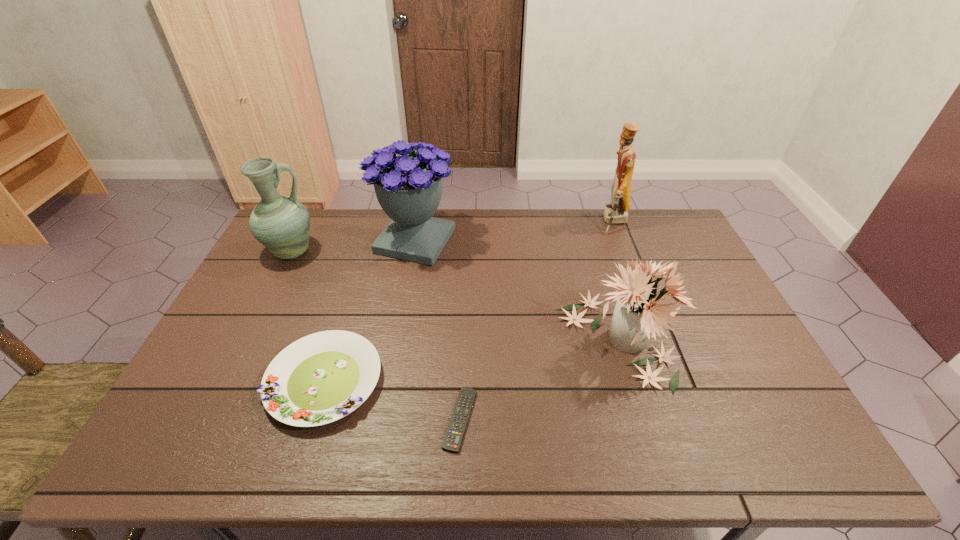
I want to click on the fourth closest object to the right bouquet, so click(320, 378).

Identify the location of blank space that satisfies the following two spatial constraints: 1. on the handle side of the fifth tallest object; 2. on the right side of the pitcher. (226, 381).

At what (x,y) coordinates should I click in order to perform the action: click on vacant region that satisfies the following two spatial constraints: 1. on the handle side of the leftmost object; 2. on the right side of the remote control. Please return your answer as a coordinate pair (x, y). Looking at the image, I should click on (206, 419).

In order to click on free spot that satisfies the following two spatial constraints: 1. on the handle side of the pitcher; 2. on the left side of the fourth tallest object in this screenshot , I will do `click(247, 339)`.

At what (x,y) coordinates should I click in order to perform the action: click on free location that satisfies the following two spatial constraints: 1. on the handle side of the pitcher; 2. on the back side of the nearer bouquet. Please return your answer as a coordinate pair (x, y). The width and height of the screenshot is (960, 540). Looking at the image, I should click on (247, 339).